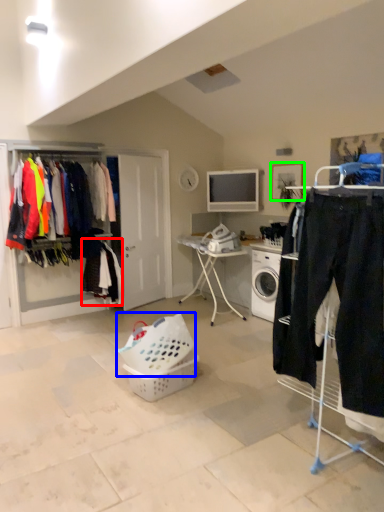
Question: Estimate the real-world distances between objects in this image. Which object is closer to clothing (highlighted by a red box), basket (highlighted by a blue box) or picture frame (highlighted by a green box)?

Choices:
 (A) basket
 (B) picture frame

Answer: (A)